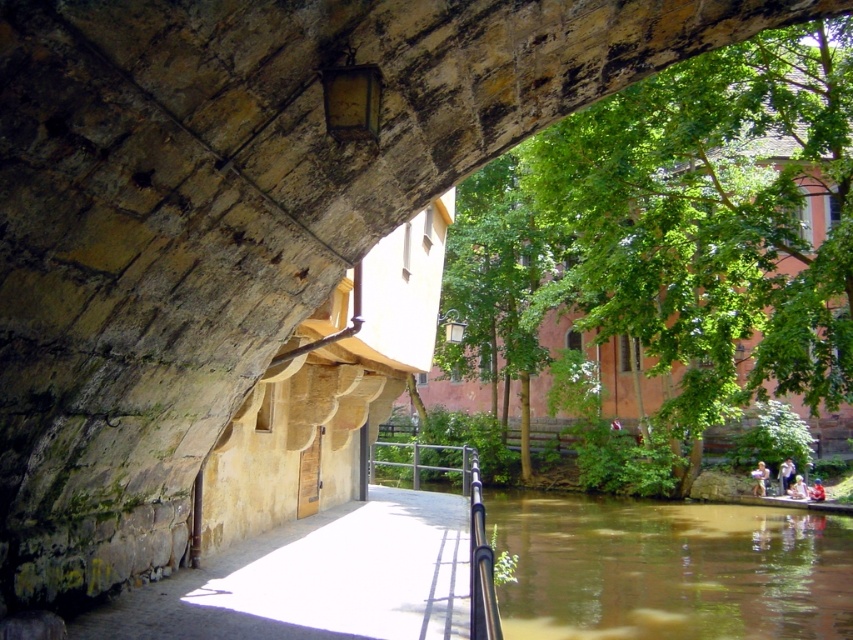
Does brown murky water at lower right have a greater height compared to polished metal railing at center?

No, brown murky water at lower right is not taller than polished metal railing at center.

From the picture: Can you confirm if brown murky water at lower right is thinner than polished metal railing at center?

No.

Measure the distance between brown murky water at lower right and camera.

The distance of brown murky water at lower right from camera is 9.32 meters.

I want to click on brown murky water at lower right, so click(x=669, y=568).

Who is more forward, (x=610, y=220) or (x=474, y=561)?

Point (x=474, y=561) is more forward.

Does point (674, 273) come behind point (469, 609)?

Yes, point (674, 273) is farther from viewer.

Image resolution: width=853 pixels, height=640 pixels. What are the coordinates of `green leafy tree at center` in the screenshot? It's located at (695, 218).

How distant is green leafy tree at center from polished metal railing at center?

They are 8.09 meters apart.

Which of these two, green leafy tree at center or polished metal railing at center, stands shorter?

With less height is polished metal railing at center.

This screenshot has width=853, height=640. In order to click on green leafy tree at center in this screenshot , I will do `click(695, 218)`.